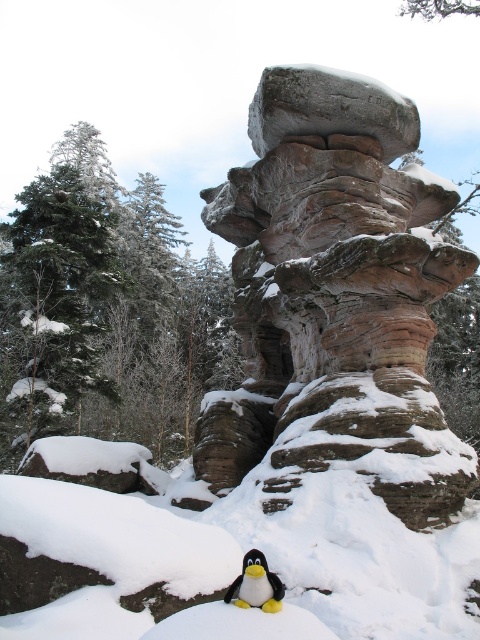
Based on the photo, can you confirm if rustic stone formation at center is positioned to the left of black plush penguin at lower center?

In fact, rustic stone formation at center is to the right of black plush penguin at lower center.

Looking at this image, between rustic stone formation at center and black plush penguin at lower center, which one appears on the right side from the viewer's perspective?

Positioned to the right is rustic stone formation at center.

Between point (226, 227) and point (271, 580), which one is positioned in front?

Point (271, 580) is in front.

Where is `rustic stone formation at center`? The height and width of the screenshot is (640, 480). rustic stone formation at center is located at coordinates (334, 294).